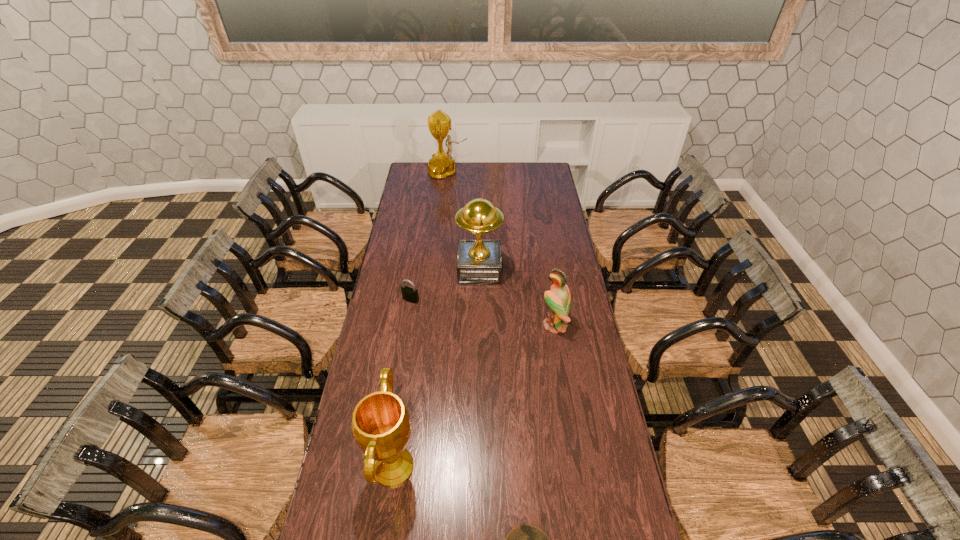
What are the coordinates of `vacant region at the right edge` in the screenshot? It's located at (550, 216).

Locate an element on the screen. The height and width of the screenshot is (540, 960). vacant area between the nearest award and the second nearest award is located at coordinates (437, 368).

Find the location of a particular element. vacant space that is in between the second farthest award and the third farthest object is located at coordinates pyautogui.click(x=445, y=285).

The width and height of the screenshot is (960, 540). What are the coordinates of `vacant area between the third farthest object and the fourth farthest object` in the screenshot? It's located at (483, 312).

Identify the location of vacant area that lies between the second nearest object and the farthest award. (420, 319).

This screenshot has width=960, height=540. What are the coordinates of `object that is the fifth closest one to the bowl` in the screenshot? It's located at (442, 165).

Identify which object is located as the nearest to the farthest object. Please provide its 2D coordinates. Your answer should be formatted as a tuple, i.e. [(x, y)], where the tuple contains the x and y coordinates of a point satisfying the conditions above.

[(479, 260)]

Select which award is the second closest to the third shortest object. Please provide its 2D coordinates. Your answer should be formatted as a tuple, i.e. [(x, y)], where the tuple contains the x and y coordinates of a point satisfying the conditions above.

[(380, 424)]

Point out which award is positioned as the second nearest to the farthest object. Please provide its 2D coordinates. Your answer should be formatted as a tuple, i.e. [(x, y)], where the tuple contains the x and y coordinates of a point satisfying the conditions above.

[(380, 424)]

Where is `free space that satisfies the following two spatial constraints: 1. on the front side of the farthest object; 2. on the front side of the padlock`? The height and width of the screenshot is (540, 960). free space that satisfies the following two spatial constraints: 1. on the front side of the farthest object; 2. on the front side of the padlock is located at coordinates click(x=435, y=300).